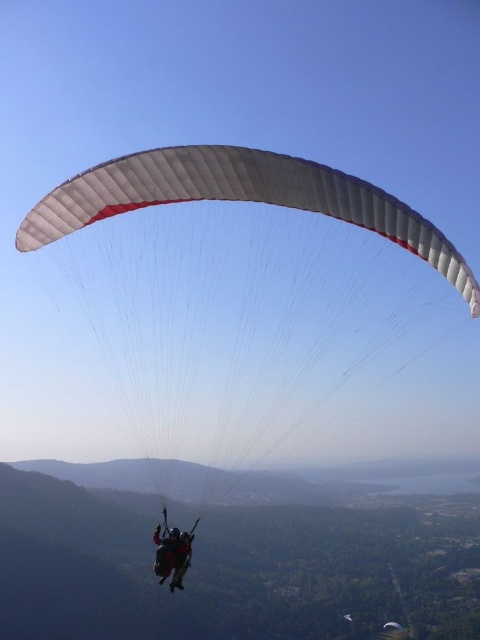
From the picture: You are a pilot flying a paraglider and you see two parachutes in the sky, a white matte parachute at center and a black fabric parachute at center. Which parachute is farther away from you?

The white matte parachute at center is farther away from you since it is 1252.62 feet away from the black fabric parachute at center, which is closer.

Based on the photo, you are a photographer trying to capture the paraglider in the center of your photo. You notice there is a point at coordinates point (x=240, y=301). What object is located at that point?

The point (x=240, y=301) is where the white matte parachute at center is located.